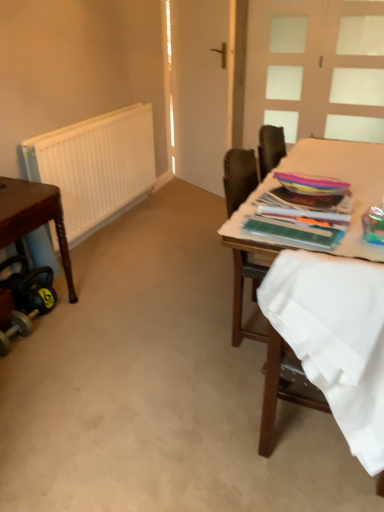
At what (x,y) coordinates should I click in order to perform the action: click on white fabric at right. Please return your answer as a coordinate pair (x, y). The image size is (384, 512). Looking at the image, I should click on tap(335, 338).

At what (x,y) coordinates should I click in order to perform the action: click on white matte radiator at left. Please return your answer as a coordinate pair (x, y). Image resolution: width=384 pixels, height=512 pixels. Looking at the image, I should click on (95, 166).

The image size is (384, 512). In order to click on wooden table at right in this screenshot , I will do `click(346, 180)`.

You are a GUI agent. You are given a task and a screenshot of the screen. Output one action in this format:
    pyautogui.click(x=<x>, y=<y>)
    Task: Click on the white matte barn door at center
    This screenshot has height=512, width=384.
    Given the screenshot: What is the action you would take?
    pyautogui.click(x=200, y=89)

I want to click on multicolored plastic magazine at right, so click(x=296, y=221).

At what (x,y) coordinates should I click in order to perform the action: click on white fabric at right. Please return your answer as a coordinate pair (x, y). Image resolution: width=384 pixels, height=512 pixels. Looking at the image, I should click on (335, 338).

Considering the relative sizes of wooden chair at right and white matte radiator at left in the image provided, is wooden chair at right taller than white matte radiator at left?

Indeed, wooden chair at right has a greater height compared to white matte radiator at left.

Which object is positioned more to the left, wooden chair at right or white matte radiator at left?

From the viewer's perspective, white matte radiator at left appears more on the left side.

Consider the image. Is the depth of wooden chair at right less than that of white matte radiator at left?

Yes, wooden chair at right is closer to the camera.

Can you tell me how much wooden chair at right and white matte radiator at left differ in facing direction?

The angle between the facing direction of wooden chair at right and the facing direction of white matte radiator at left is 89.1 degrees.

How far apart are white fabric at right and wooden table at right?

They are 62.12 centimeters apart.

From a real-world perspective, who is located higher, white fabric at right or wooden table at right?

wooden table at right is physically above.

The height and width of the screenshot is (512, 384). What are the coordinates of `fabric lying on the left of wooden table at right` in the screenshot? It's located at (335, 338).

Considering the sizes of objects white fabric at right and wooden table at right in the image provided, who is smaller, white fabric at right or wooden table at right?

white fabric at right.

The height and width of the screenshot is (512, 384). I want to click on barn door above the wooden table at right (from the image's perspective), so click(200, 89).

From a real-world perspective, which is physically above, white matte barn door at center or wooden table at right?

In real-world perspective, white matte barn door at center is above.

Considering the positions of objects white matte barn door at center and wooden table at right in the image provided, who is more to the right, white matte barn door at center or wooden table at right?

Positioned to the right is wooden table at right.

Is white fabric at right not within white matte barn door at center?

Yes, white fabric at right is not within white matte barn door at center.

From a real-world perspective, which is physically below, white fabric at right or white matte barn door at center?

white fabric at right, from a real-world perspective.

In the scene shown: Can you confirm if white fabric at right is shorter than white matte barn door at center?

Yes.

In the scene shown: Is white frosted glass door at upper right taller than white fabric at right?

Indeed, white frosted glass door at upper right has a greater height compared to white fabric at right.

Is white frosted glass door at upper right next to white fabric at right?

No, white frosted glass door at upper right is not in contact with white fabric at right.

Can you tell me how much white frosted glass door at upper right and white fabric at right differ in facing direction?

The angle between the facing direction of white frosted glass door at upper right and the facing direction of white fabric at right is 180 degrees.

Measure the distance between white frosted glass door at upper right and white fabric at right.

white frosted glass door at upper right is 3.71 meters away from white fabric at right.

At what (x,y) coordinates should I click in order to perform the action: click on barn door below the white frosted glass door at upper right (from the image's perspective). Please return your answer as a coordinate pair (x, y). The width and height of the screenshot is (384, 512). Looking at the image, I should click on (200, 89).

Is white matte barn door at center in contact with white frosted glass door at upper right?

No, white matte barn door at center is not touching white frosted glass door at upper right.

In terms of width, does white matte barn door at center look wider or thinner when compared to white frosted glass door at upper right?

Considering their sizes, white matte barn door at center looks broader than white frosted glass door at upper right.

From the image's perspective, does wooden table at right appear higher than white frosted glass door at upper right?

Incorrect, from the image's perspective, wooden table at right is lower than white frosted glass door at upper right.

Which of these two, wooden table at right or white frosted glass door at upper right, is bigger?

wooden table at right is bigger.

Is wooden table at right positioned far away from white frosted glass door at upper right?

Yes.

Who is shorter, wooden table at right or white frosted glass door at upper right?

A: With less height is wooden table at right.

Find the location of a particular element. radiator above the wooden chair at right (from the image's perspective) is located at coordinates (95, 166).

The height and width of the screenshot is (512, 384). I want to click on fabric in front of the wooden table at right, so click(x=335, y=338).

Estimate the real-world distances between objects in this image. Which object is closer to white fabric at right, white matte barn door at center or wooden chair at right?

The object closer to white fabric at right is wooden chair at right.

Based on their spatial positions, is white matte barn door at center or brown wooden table at left further from multicolored plastic magazine at right?

white matte barn door at center is positioned further to the anchor multicolored plastic magazine at right.

Estimate the real-world distances between objects in this image. Which object is closer to wooden table at right, brown wooden table at left or white fabric at right?

white fabric at right lies closer to wooden table at right than the other object.

Which object lies nearer to the anchor point brown wooden table at left, multicolored plastic magazine at right or white matte barn door at center?

Among the two, multicolored plastic magazine at right is located nearer to brown wooden table at left.

Considering their positions, is wooden chair at right positioned further to brown wooden table at left than white matte barn door at center?

white matte barn door at center lies further to brown wooden table at left than the other object.

Which object lies further to the anchor point brown wooden table at left, white matte radiator at left or white matte barn door at center?

white matte barn door at center is positioned further to the anchor brown wooden table at left.

Considering their positions, is wooden chair at right positioned further to white matte barn door at center than white fabric at right?

white fabric at right is positioned further to the anchor white matte barn door at center.

Estimate the real-world distances between objects in this image. Which object is further from white frosted glass door at upper right, wooden table at right or multicolored plastic magazine at right?

multicolored plastic magazine at right is positioned further to the anchor white frosted glass door at upper right.

Image resolution: width=384 pixels, height=512 pixels. In order to click on table top between white fabric at right and white matte radiator at left in the front-back direction in this screenshot , I will do 346,180.

The image size is (384, 512). I want to click on chair between white fabric at right and white matte radiator at left along the z-axis, so click(264, 340).

Locate an element on the screen. The image size is (384, 512). radiator positioned between wooden table at right and white frosted glass door at upper right from near to far is located at coordinates (95, 166).

Where is `magazine positioned between wooden table at right and white frosted glass door at upper right from near to far`? The width and height of the screenshot is (384, 512). magazine positioned between wooden table at right and white frosted glass door at upper right from near to far is located at coordinates (296, 221).